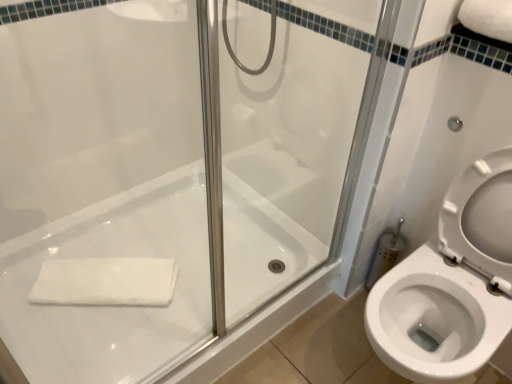
Question: From the image's perspective, is white glossy bath at center above or below white soft towel at upper right, acting as the 2th bath towel starting from the back?

Choices:
 (A) above
 (B) below

Answer: (B)

Question: Which is correct: white glossy bath at center is inside white soft towel at upper right, the first bath towel in the top-to-bottom sequence, or outside of it?

Choices:
 (A) inside
 (B) outside

Answer: (B)

Question: Based on their relative distances, which object is nearer to the white cotton bath towel at lower left, which appears as the first bath towel when ordered from the bottom?

Choices:
 (A) white soft towel at upper right, marked as the second bath towel in a bottom-to-top arrangement
 (B) white glossy bath at center

Answer: (B)

Question: Considering the real-world distances, which object is farthest from the white glossy bath at center?

Choices:
 (A) white cotton bath towel at lower left, which appears as the second bath towel when viewed from the right
 (B) white soft towel at upper right, acting as the 1th bath towel starting from the front

Answer: (B)